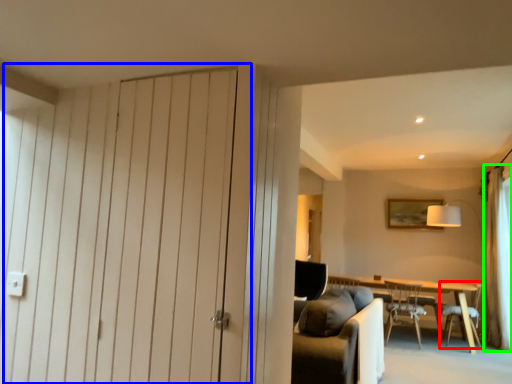
Question: Estimate the real-world distances between objects in this image. Which object is closer to chair (highlighted by a red box), door (highlighted by a blue box) or curtain (highlighted by a green box)?

Choices:
 (A) door
 (B) curtain

Answer: (B)